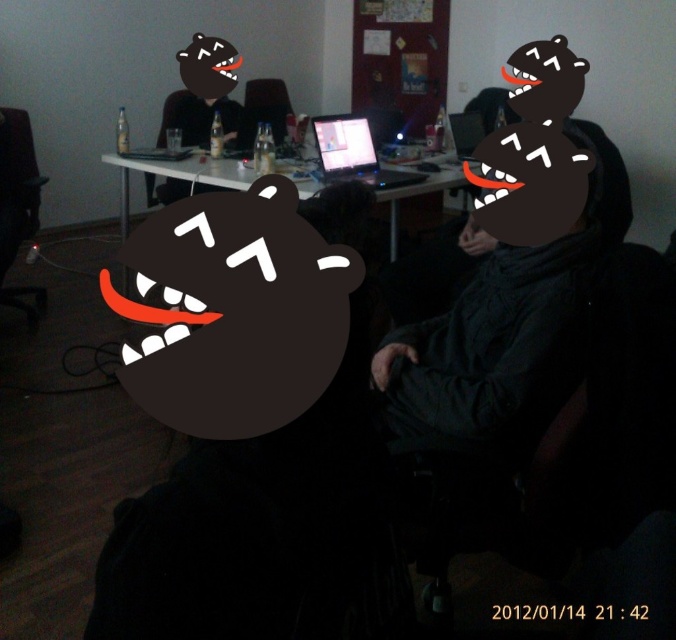
Consider the image. You are setting up a photo shoot in this room and want to place the black matte bear head at center and the matte plastic laptop at center so that the bear head is the focal point. Given their sizes, which object should you position closer to the camera to achieve this?

The black matte bear head at center is smaller than the matte plastic laptop at center. To make the bear head the focal point, position it closer to the camera so that its size in the frame appears larger relative to the laptop.

You are trying to decide whether to place a small decorative item on the black matte bear head at center or the matte plastic laptop at center. Based on their heights, which object would allow the item to be more visible to someone standing in front of both objects?

The matte plastic laptop at center is taller than the black matte bear head at center, so placing the item on the matte plastic laptop at center would make it more visible to someone standing in front of both objects.

You are organizing a photo shoot and need to ensure that the matte black face at center and the white glossy table at center are properly framed. Based on their sizes, which object should be placed closer to the camera to maintain a balanced composition?

The matte black face at center should be placed closer to the camera because it occupies less space than the white glossy table at center, so moving it forward can help balance the composition.